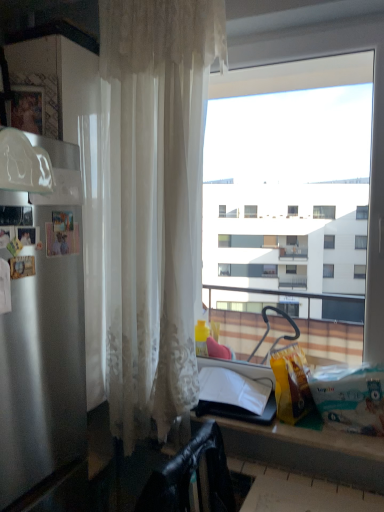
Measure the distance between transparent glass window at center and camera.

1.51 meters.

Locate an element on the screen. This screenshot has height=512, width=384. sheer white curtain at left is located at coordinates (156, 202).

Find the location of a particular element. The width and height of the screenshot is (384, 512). matte black counter at lower center is located at coordinates (306, 451).

What is the approximate width of black leather chair at lower left?

The width of black leather chair at lower left is 9.75 inches.

This screenshot has width=384, height=512. Identify the location of black leather chair at lower left. (190, 477).

The height and width of the screenshot is (512, 384). I want to click on transparent glass window at center, so click(287, 182).

Can you confirm if black leather chair at lower left is thinner than matte black counter at lower center?

Yes, black leather chair at lower left is thinner than matte black counter at lower center.

Consider the image. Is there a large distance between black leather chair at lower left and matte black counter at lower center?

Actually, black leather chair at lower left and matte black counter at lower center are a little close together.

From the image's perspective, is black leather chair at lower left located beneath matte black counter at lower center?

Yes, from the image's perspective, black leather chair at lower left is below matte black counter at lower center.

Considering the points (20, 336) and (209, 498), which point is in front, point (20, 336) or point (209, 498)?

The point (20, 336) is in front.

Does satin silver refrigerator at left have a larger size compared to black leather chair at lower left?

Yes.

Is black leather chair at lower left completely or partially inside satin silver refrigerator at left?

No, satin silver refrigerator at left does not contain black leather chair at lower left.

Is matte black counter at lower center placed right next to transparent glass window at center?

matte black counter at lower center and transparent glass window at center are not in contact.

From a real-world perspective, which is physically below, matte black counter at lower center or transparent glass window at center?

matte black counter at lower center is physically lower.

Is matte black counter at lower center taller or shorter than transparent glass window at center?

Considering their sizes, matte black counter at lower center has less height than transparent glass window at center.

From the image's perspective, is matte black counter at lower center located above or below transparent glass window at center?

matte black counter at lower center is below transparent glass window at center.

Is the surface of black leather chair at lower left in direct contact with satin silver refrigerator at left?

No, black leather chair at lower left is not touching satin silver refrigerator at left.

Between black leather chair at lower left and satin silver refrigerator at left, which one has smaller size?

black leather chair at lower left is smaller.

From their relative heights in the image, would you say black leather chair at lower left is taller or shorter than satin silver refrigerator at left?

black leather chair at lower left is shorter than satin silver refrigerator at left.

From the image's perspective, is black leather chair at lower left located above or below satin silver refrigerator at left?

From the image's perspective, black leather chair at lower left appears below satin silver refrigerator at left.

Is black leather chair at lower left oriented towards sheer white curtain at left?

No, black leather chair at lower left is not oriented towards sheer white curtain at left.

From the image's perspective, which is below, black leather chair at lower left or sheer white curtain at left?

black leather chair at lower left.

What's the angular difference between black leather chair at lower left and sheer white curtain at left's facing directions?

The angular difference between black leather chair at lower left and sheer white curtain at left is 80.4 degrees.

Which of these two, black leather chair at lower left or sheer white curtain at left, is thinner?

sheer white curtain at left is thinner.

Is satin silver refrigerator at left taller or shorter than sheer white curtain at left?

In the image, satin silver refrigerator at left appears to be shorter than sheer white curtain at left.

Is satin silver refrigerator at left inside or outside of sheer white curtain at left?

satin silver refrigerator at left is not inside sheer white curtain at left, it's outside.

Looking at this image, considering the sizes of objects satin silver refrigerator at left and sheer white curtain at left in the image provided, who is wider, satin silver refrigerator at left or sheer white curtain at left?

satin silver refrigerator at left is wider.

Which object is closer to the camera, satin silver refrigerator at left or sheer white curtain at left?

Positioned in front is satin silver refrigerator at left.

From the image's perspective, is matte black counter at lower center located beneath black leather chair at lower left?

No, from the image's perspective, matte black counter at lower center is not below black leather chair at lower left.

From a real-world perspective, is matte black counter at lower center beneath black leather chair at lower left?

Actually, matte black counter at lower center is physically above black leather chair at lower left in the real world.

Can we say matte black counter at lower center lies outside black leather chair at lower left?

Yes.

Would you say matte black counter at lower center is to the left or to the right of black leather chair at lower left in the picture?

In the image, matte black counter at lower center appears on the right side of black leather chair at lower left.

Where is `chair on the left of matte black counter at lower center`? chair on the left of matte black counter at lower center is located at coordinates (190, 477).

Locate an element on the screen. Image resolution: width=384 pixels, height=512 pixels. appliance that appears above the black leather chair at lower left (from a real-world perspective) is located at coordinates (44, 349).

From the image, which object appears to be nearer to satin silver refrigerator at left, transparent glass window at center or black leather chair at lower left?

black leather chair at lower left lies closer to satin silver refrigerator at left than the other object.

From the image, which object appears to be nearer to matte black counter at lower center, sheer white curtain at left or transparent glass window at center?

sheer white curtain at left.

From the image, which object appears to be nearer to satin silver refrigerator at left, black leather chair at lower left or transparent glass window at center?

black leather chair at lower left is positioned closer to the anchor satin silver refrigerator at left.

Which object lies further to the anchor point black leather chair at lower left, satin silver refrigerator at left or sheer white curtain at left?

sheer white curtain at left lies further to black leather chair at lower left than the other object.

Based on their spatial positions, is black leather chair at lower left or matte black counter at lower center closer to transparent glass window at center?

matte black counter at lower center is positioned closer to the anchor transparent glass window at center.

Looking at the image, which one is located further to matte black counter at lower center, satin silver refrigerator at left or black leather chair at lower left?

satin silver refrigerator at left.

Looking at the image, which one is located further to transparent glass window at center, sheer white curtain at left or black leather chair at lower left?

black leather chair at lower left lies further to transparent glass window at center than the other object.

Estimate the real-world distances between objects in this image. Which object is closer to matte black counter at lower center, satin silver refrigerator at left or transparent glass window at center?

Based on the image, satin silver refrigerator at left appears to be nearer to matte black counter at lower center.

Identify the location of curtain between transparent glass window at center and matte black counter at lower center from top to bottom. The height and width of the screenshot is (512, 384). (156, 202).

Where is `curtain between transparent glass window at center and black leather chair at lower left vertically`? This screenshot has width=384, height=512. curtain between transparent glass window at center and black leather chair at lower left vertically is located at coordinates (156, 202).

Where is `curtain between satin silver refrigerator at left and transparent glass window at center`? curtain between satin silver refrigerator at left and transparent glass window at center is located at coordinates (156, 202).

What are the coordinates of `counter between sheer white curtain at left and black leather chair at lower left from top to bottom` in the screenshot? It's located at (306, 451).